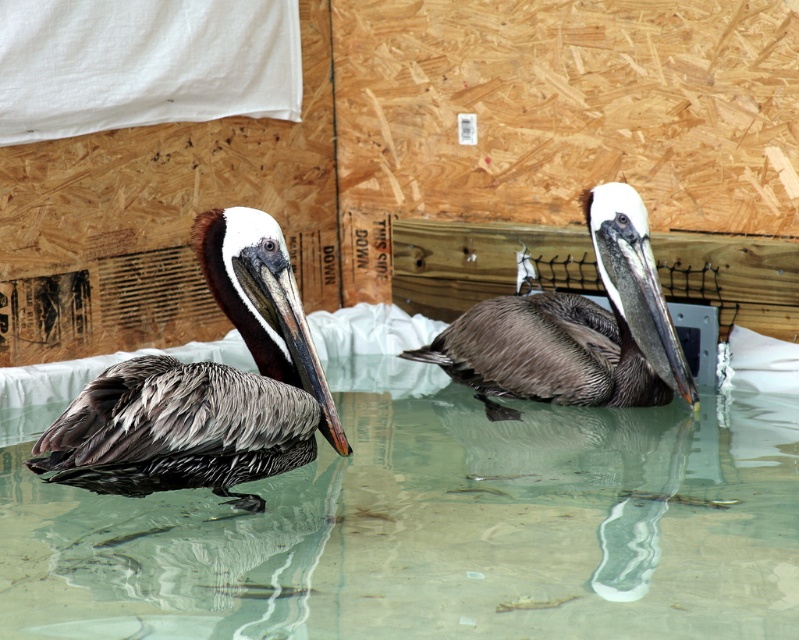
Question: Is brown feathered pelican at left smaller than brown feathered pelican at center?

Choices:
 (A) yes
 (B) no

Answer: (A)

Question: Is clear water at center closer to camera compared to brown feathered pelican at left?

Choices:
 (A) no
 (B) yes

Answer: (B)

Question: Which object is farther from the camera taking this photo?

Choices:
 (A) brown feathered pelican at left
 (B) brown feathered pelican at center

Answer: (B)

Question: Considering the relative positions of clear water at center and brown feathered pelican at left in the image provided, where is clear water at center located with respect to brown feathered pelican at left?

Choices:
 (A) below
 (B) above

Answer: (A)

Question: Which point appears closest to the camera in this image?

Choices:
 (A) (259, 248)
 (B) (611, 378)
 (C) (324, 620)

Answer: (C)

Question: Which point is farther from the camera taking this photo?

Choices:
 (A) (392, 380)
 (B) (197, 256)

Answer: (A)